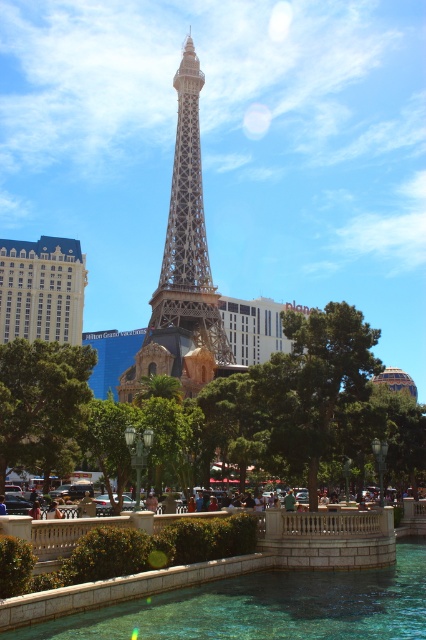
Between metallic lattice tower at center and green leafy tree at center, which one is positioned lower?

Positioned lower is green leafy tree at center.

What do you see at coordinates (184, 268) in the screenshot? The width and height of the screenshot is (426, 640). I see `metallic lattice tower at center` at bounding box center [184, 268].

You are a GUI agent. You are given a task and a screenshot of the screen. Output one action in this format:
    pyautogui.click(x=<x>, y=<y>)
    Task: Click on the metallic lattice tower at center
    The height and width of the screenshot is (640, 426).
    Given the screenshot: What is the action you would take?
    pyautogui.click(x=184, y=268)

Find the location of a particular element. green leafy tree at center is located at coordinates (42, 404).

Is green leafy tree at center closer to camera compared to matte blue building at left?

Yes.

Identify the location of green leafy tree at center. The height and width of the screenshot is (640, 426). (42, 404).

Is clear glass pool at center shorter than matte blue building at left?

Yes.

Can you confirm if clear glass pool at center is smaller than matte blue building at left?

Indeed, clear glass pool at center has a smaller size compared to matte blue building at left.

What do you see at coordinates (267, 608) in the screenshot? This screenshot has width=426, height=640. I see `clear glass pool at center` at bounding box center [267, 608].

Identify the location of clear glass pool at center. (267, 608).